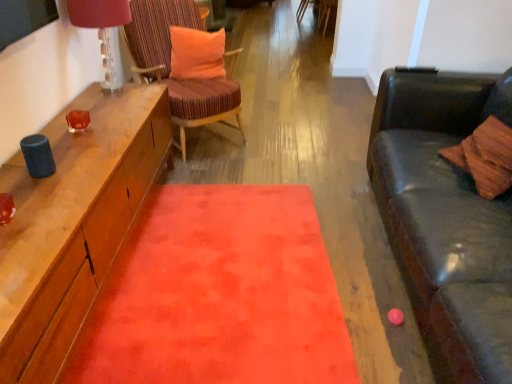
The width and height of the screenshot is (512, 384). Find the location of `empty space that is ontop of velvet orange rug at center (from a real-world perspective)`. empty space that is ontop of velvet orange rug at center (from a real-world perspective) is located at coordinates (225, 261).